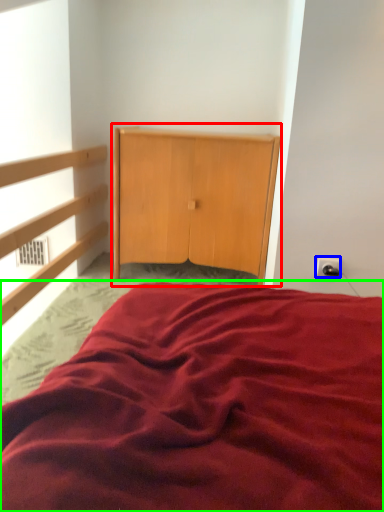
Question: Considering the real-world distances, which object is closest to dresser (highlighted by a red box)? electric outlet (highlighted by a blue box) or bed (highlighted by a green box).

Choices:
 (A) electric outlet
 (B) bed

Answer: (A)